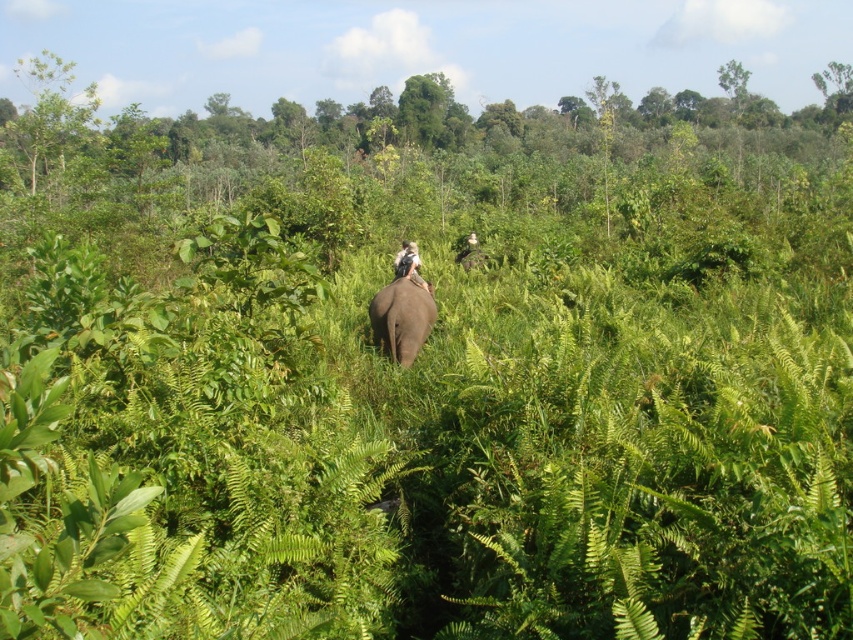
Can you confirm if green leafy tree at upper left is wider than white cloth at center?

Correct, the width of green leafy tree at upper left exceeds that of white cloth at center.

Can you confirm if green leafy tree at upper left is shorter than white cloth at center?

No.

Between point (49, 157) and point (413, 248), which one is positioned in front?

Point (413, 248) is more forward.

Where is `green leafy tree at upper left`? The height and width of the screenshot is (640, 853). green leafy tree at upper left is located at coordinates (49, 113).

Looking at this image, which of these two, gray matte elephant at center or white cloth at center, stands shorter?

Standing shorter between the two is white cloth at center.

Is point (401, 291) more distant than point (403, 250)?

No, it is not.

I want to click on gray matte elephant at center, so click(x=401, y=320).

Which is behind, point (410, 275) or point (405, 275)?

The point (405, 275) is more distant.

Between point (431, 288) and point (413, 273), which one is positioned in front?

Point (413, 273) is more forward.

Is point (395, 269) positioned before point (402, 250)?

Yes.

Identify the location of white cloth at center. (410, 266).